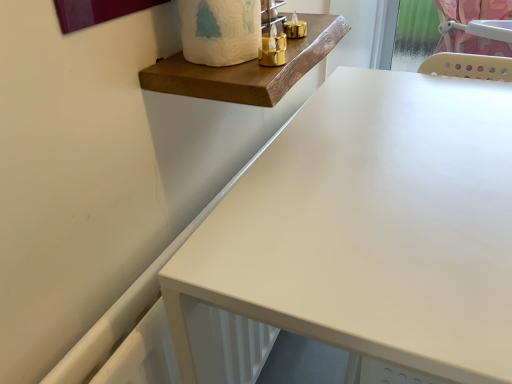
Question: Is white matte toilet paper at upper center wider or thinner than wooden plank at upper center?

Choices:
 (A) wide
 (B) thin

Answer: (B)

Question: Choose the correct answer: Is white matte toilet paper at upper center inside wooden plank at upper center or outside it?

Choices:
 (A) inside
 (B) outside

Answer: (B)

Question: Which is nearer to the wooden plank at upper center?

Choices:
 (A) white matte toilet paper at upper center
 (B) matte white table at center

Answer: (A)

Question: Which object is positioned closest to the wooden plank at upper center?

Choices:
 (A) matte white table at center
 (B) white matte toilet paper at upper center

Answer: (B)